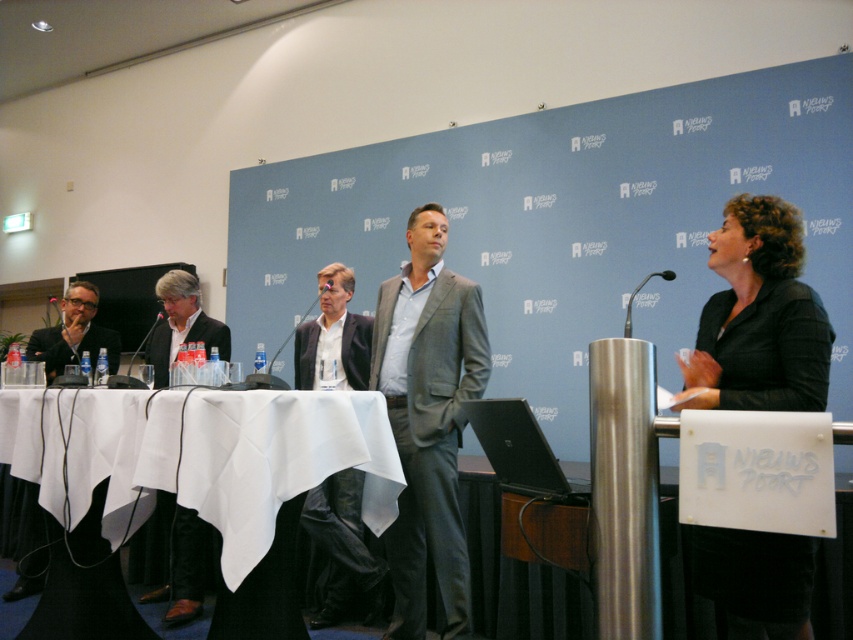
Between gray textured suit at center and matte black microphone at center, which one is positioned higher?

matte black microphone at center is higher up.

Is point (405, 435) less distant than point (270, 372)?

That is False.

Does point (374, 381) come in front of point (282, 340)?

That is True.

Locate an element on the screen. gray textured suit at center is located at coordinates (428, 419).

Which of these two, black textured blazer at right or black plastic microphone at left, stands shorter?

Standing shorter between the two is black plastic microphone at left.

Who is higher up, black textured blazer at right or black plastic microphone at left?

black textured blazer at right

Where is `black textured blazer at right`? black textured blazer at right is located at coordinates (759, 317).

Who is positioned more to the right, dark gray fabric business suit at left or black plastic microphone at left?

Positioned to the right is black plastic microphone at left.

Is dark gray fabric business suit at left below black plastic microphone at left?

Yes, dark gray fabric business suit at left is below black plastic microphone at left.

This screenshot has width=853, height=640. Describe the element at coordinates (71, 348) in the screenshot. I see `dark gray fabric business suit at left` at that location.

Identify the location of dark gray fabric business suit at left. Image resolution: width=853 pixels, height=640 pixels. (71, 348).